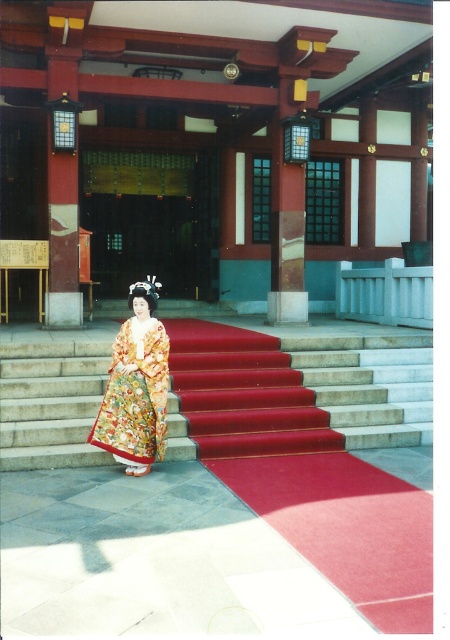
Who is higher up, smooth concrete stairs at center or floral silk kimono at center?

Positioned higher is floral silk kimono at center.

The width and height of the screenshot is (450, 640). I want to click on smooth concrete stairs at center, so click(x=365, y=380).